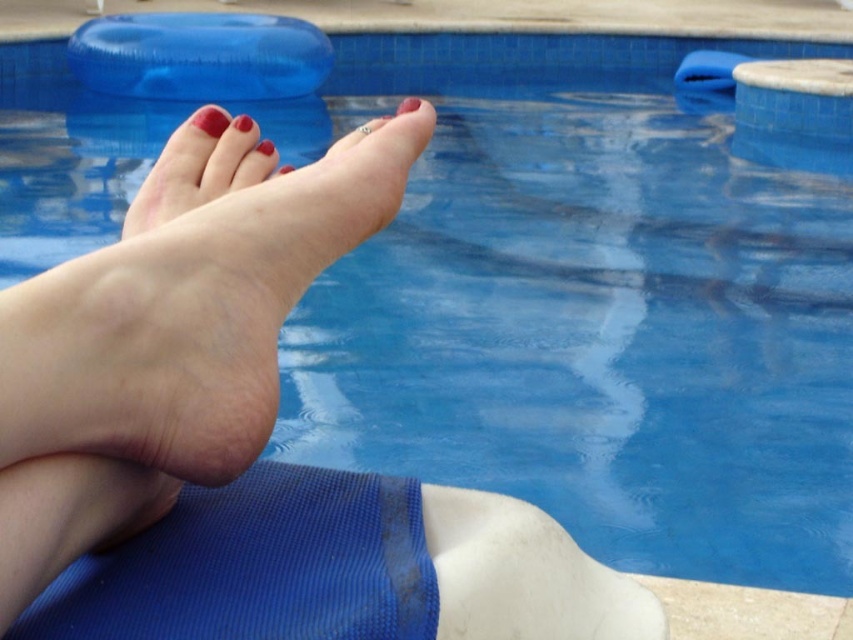
Is point (142, 208) more distant than point (407, 106)?

No, (142, 208) is in front of (407, 106).

I want to click on matte skin foot at center, so click(x=196, y=170).

Is glossy nail polish toe at upper center in front of matte pink toe at center?

No, it is not.

Can you confirm if glossy nail polish toe at upper center is shorter than matte pink toe at center?

Yes, glossy nail polish toe at upper center is shorter than matte pink toe at center.

Does point (239, 115) come in front of point (283, 172)?

No, (239, 115) is further to viewer.

Locate an element on the screen. glossy nail polish toe at upper center is located at coordinates (242, 122).

Who is more forward, (144, 336) or (289, 166)?

Positioned in front is point (144, 336).

Find the location of a particular element. smooth skin foot at center is located at coordinates (189, 316).

Between point (30, 285) and point (288, 168), which one is positioned in front?

Point (30, 285) is in front.

What are the coordinates of `smooth skin foot at center` in the screenshot? It's located at (189, 316).